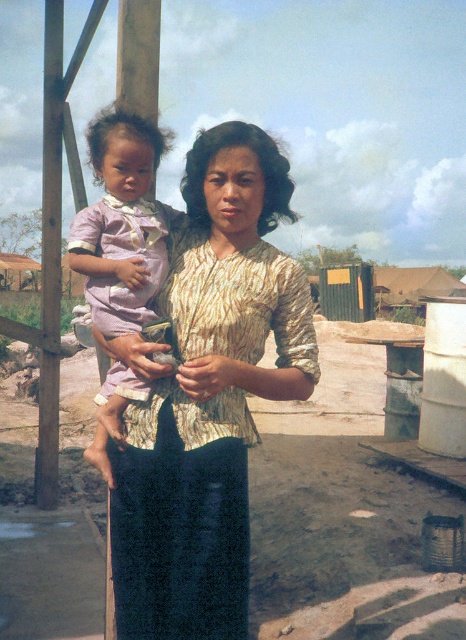
Between printed fabric blouse at center and pink satin dress at left, which one is positioned higher?

pink satin dress at left is higher up.

Which of these two, printed fabric blouse at center or pink satin dress at left, stands taller?

printed fabric blouse at center

Image resolution: width=466 pixels, height=640 pixels. What do you see at coordinates (207, 396) in the screenshot?
I see `printed fabric blouse at center` at bounding box center [207, 396].

Locate an element on the screen. The width and height of the screenshot is (466, 640). printed fabric blouse at center is located at coordinates (207, 396).